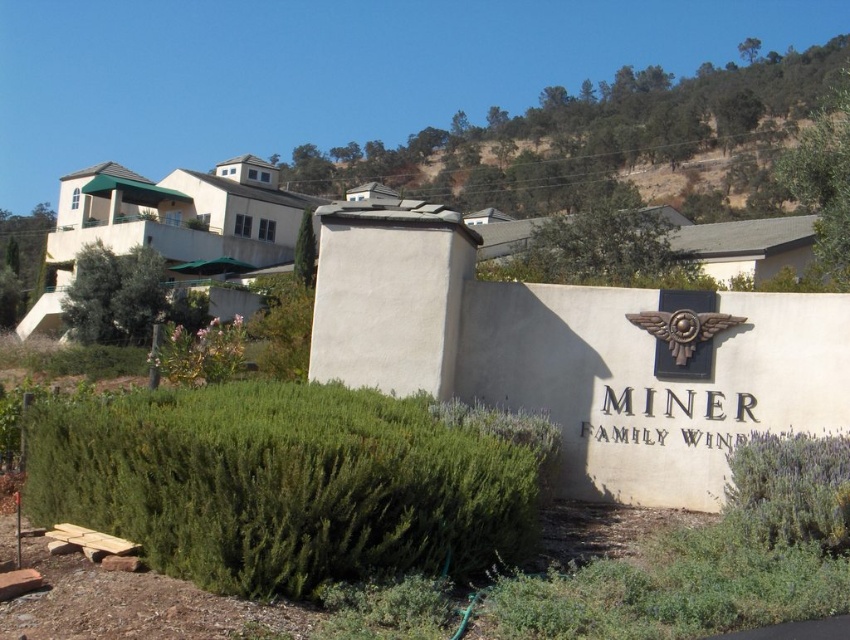
Is green leafy hedge at lower right in front of green leafy bush at left?

Yes, green leafy hedge at lower right is in front of green leafy bush at left.

In order to click on green leafy hedge at lower right in this screenshot , I will do `click(790, 490)`.

What are the coordinates of `green leafy hedge at lower right` in the screenshot? It's located at (790, 490).

Which is more to the left, dull brown dirt at upper center or green leafy bush at left?

Positioned to the left is green leafy bush at left.

Who is more distant from viewer, [720,147] or [149,339]?

The point [720,147] is more distant.

Identify the location of dull brown dirt at upper center. (585, 132).

Does green leafy bush at left have a greater width compared to green leafy bush at upper right?

No, green leafy bush at left is not wider than green leafy bush at upper right.

Can you confirm if green leafy bush at left is positioned to the left of green leafy bush at upper right?

Indeed, green leafy bush at left is positioned on the left side of green leafy bush at upper right.

Identify the location of green leafy bush at left. (114, 296).

Locate an element on the screen. The width and height of the screenshot is (850, 640). green leafy bush at left is located at coordinates (114, 296).